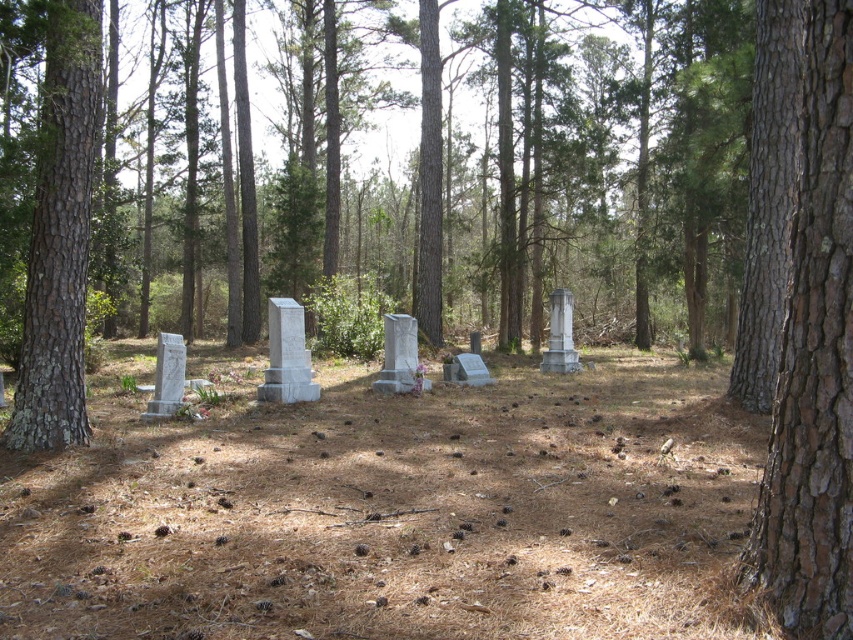
Question: Among these objects, which one is farthest from the camera?

Choices:
 (A) brown rough bark tree at right
 (B) lichen-covered bark tree at left

Answer: (B)

Question: Does brown rough bark tree at right appear under lichen-covered bark tree at left?

Choices:
 (A) no
 (B) yes

Answer: (B)

Question: Among these objects, which one is farthest from the camera?

Choices:
 (A) brown rough bark tree at right
 (B) lichen-covered bark tree at left

Answer: (B)

Question: From the image, what is the correct spatial relationship of brown rough bark tree at right in relation to lichen-covered bark tree at left?

Choices:
 (A) left
 (B) right

Answer: (B)

Question: Is the position of brown rough bark tree at right more distant than that of lichen-covered bark tree at left?

Choices:
 (A) yes
 (B) no

Answer: (B)